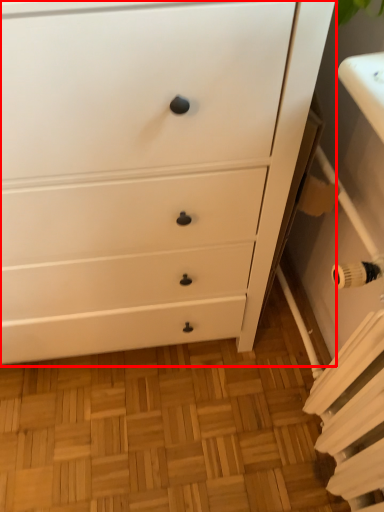
Question: From the image's perspective, what is the correct spatial positioning of chest of drawers (annotated by the red box) in reference to radiator?

Choices:
 (A) above
 (B) below

Answer: (A)